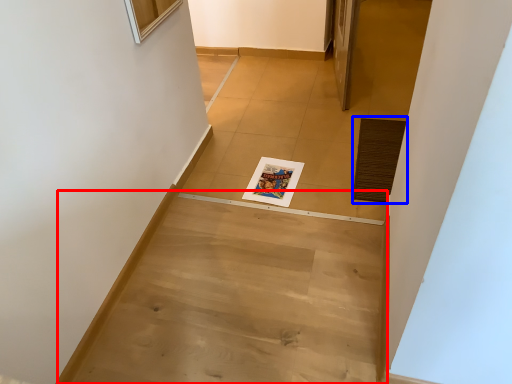
Question: Which object appears closest to the camera in this image, stairwell (highlighted by a red box) or doormat (highlighted by a blue box)?

Choices:
 (A) stairwell
 (B) doormat

Answer: (A)